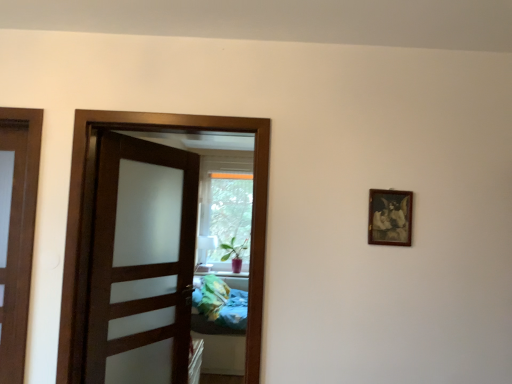
The width and height of the screenshot is (512, 384). Describe the element at coordinates (390, 217) in the screenshot. I see `wooden picture frame at upper right` at that location.

The height and width of the screenshot is (384, 512). In order to click on green matte plant at center in this screenshot , I will do `click(233, 249)`.

Are green matte plant at center and wooden picture frame at upper right located far from each other?

Absolutely, green matte plant at center is distant from wooden picture frame at upper right.

Considering the positions of point (246, 239) and point (369, 209), is point (246, 239) closer or farther from the camera than point (369, 209)?

Point (246, 239) appears to be farther away from the viewer than point (369, 209).

From the image's perspective, which is below, green matte plant at center or wooden picture frame at upper right?

green matte plant at center is shown below in the image.

From a real-world perspective, which is physically below, green matte plant at center or wooden picture frame at upper right?

green matte plant at center, from a real-world perspective.

Between brown wooden door at center and wooden picture frame at upper right, which one is positioned in front?

brown wooden door at center.

In terms of width, does brown wooden door at center look wider or thinner when compared to wooden picture frame at upper right?

Considering their sizes, brown wooden door at center looks broader than wooden picture frame at upper right.

Is brown wooden door at center smaller than wooden picture frame at upper right?

No.

Can you confirm if brown wooden door at center is taller than wooden picture frame at upper right?

Correct, brown wooden door at center is much taller as wooden picture frame at upper right.

In the scene shown: Is green matte plant at center located outside brown wooden door at center?

That's correct, green matte plant at center is outside of brown wooden door at center.

Measure the distance from green matte plant at center to brown wooden door at center.

green matte plant at center is 3.30 meters from brown wooden door at center.

Can you confirm if green matte plant at center is shorter than brown wooden door at center?

Indeed, green matte plant at center has a lesser height compared to brown wooden door at center.

Which is in front, point (238, 251) or point (127, 126)?

Positioned in front is point (127, 126).

Considering the relative positions of brown wooden door at center and green matte plant at center in the image provided, is brown wooden door at center in front of green matte plant at center?

Yes, brown wooden door at center is closer to the viewer.

Which is nearer, (110,118) or (231,246)?

Point (110,118)

This screenshot has height=384, width=512. What are the coordinates of `plant that is behind the brown wooden door at center` in the screenshot? It's located at (233, 249).

Can we say brown wooden door at center lies outside green matte plant at center?

Yes, brown wooden door at center is not within green matte plant at center.

Is wooden picture frame at upper right completely or partially outside of green matte plant at center?

wooden picture frame at upper right lies outside green matte plant at center's area.

Is wooden picture frame at upper right positioned far away from green matte plant at center?

wooden picture frame at upper right is far away from green matte plant at center.

Looking at this image, can you tell me how much wooden picture frame at upper right and green matte plant at center differ in facing direction?

94 degrees separate the facing orientations of wooden picture frame at upper right and green matte plant at center.

Does wooden picture frame at upper right have a greater width compared to green matte plant at center?

In fact, wooden picture frame at upper right might be narrower than green matte plant at center.

From the image's perspective, which object appears higher, wooden picture frame at upper right or brown wooden door at center?

wooden picture frame at upper right is shown above in the image.

Consider the image. Is wooden picture frame at upper right positioned far away from brown wooden door at center?

No, wooden picture frame at upper right is not far away from brown wooden door at center.

What's the angular difference between wooden picture frame at upper right and brown wooden door at center's facing directions?

They differ by 1.42 degrees in their facing directions.

Is wooden picture frame at upper right positioned with its back to brown wooden door at center?

No, brown wooden door at center is not at the back of wooden picture frame at upper right.

This screenshot has height=384, width=512. What are the coordinates of `picture frame on the right of green matte plant at center` in the screenshot? It's located at (390, 217).

Locate an element on the screen. picture frame behind the brown wooden door at center is located at coordinates (390, 217).

Which object lies further to the anchor point brown wooden door at center, green matte plant at center or wooden picture frame at upper right?

The object further to brown wooden door at center is green matte plant at center.

From the picture: Which object lies nearer to the anchor point green matte plant at center, brown wooden door at center or wooden picture frame at upper right?

brown wooden door at center is closer to green matte plant at center.

Which object lies further to the anchor point brown wooden door at center, wooden picture frame at upper right or green matte plant at center?

Based on the image, green matte plant at center appears to be further to brown wooden door at center.

Based on their spatial positions, is green matte plant at center or brown wooden door at center closer to wooden picture frame at upper right?

brown wooden door at center lies closer to wooden picture frame at upper right than the other object.

Considering their positions, is wooden picture frame at upper right positioned further to green matte plant at center than brown wooden door at center?

wooden picture frame at upper right.

Looking at the image, which one is located further to wooden picture frame at upper right, brown wooden door at center or green matte plant at center?

green matte plant at center lies further to wooden picture frame at upper right than the other object.

Find the location of a particular element. Image resolution: width=512 pixels, height=384 pixels. picture frame between brown wooden door at center and green matte plant at center along the z-axis is located at coordinates (390, 217).